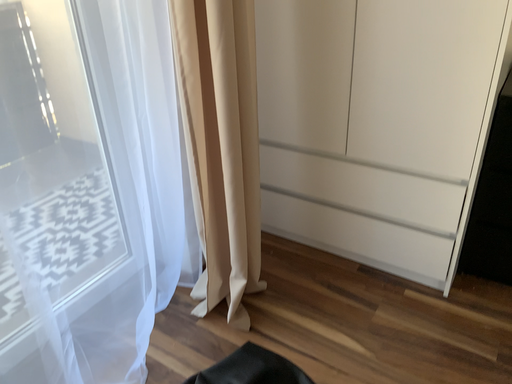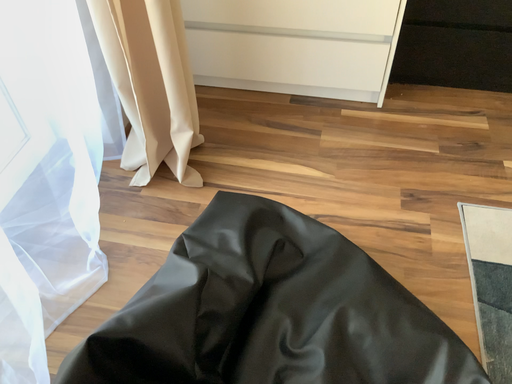
Question: How did the camera likely rotate when shooting the video?

Choices:
 (A) rotated right
 (B) rotated left

Answer: (A)